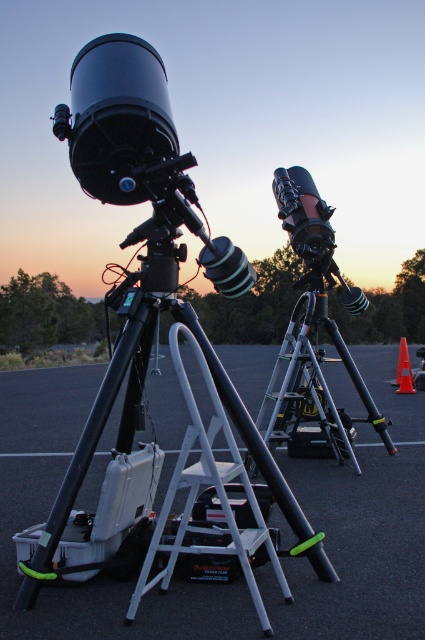
In the scene shown: You are an astronomer setting up equipment for a star observation session. You have a black plastic tripod at center. Where should you place it to align with the existing setup shown in the image?

The black plastic tripod at center should be placed at point (360, 528) as specified in the coordinates provided to align with the existing setup shown in the image.

You are an astronomer setting up equipment. You have a black plastic tripod at center and an orange plastic traffic cone at right. Which object is closer to you?

The black plastic tripod at center is closer to you because it is in front of the orange plastic traffic cone at right.

You are an astronomer setting up equipment for a star observation event. You have a black plastic tripod at center and an orange plastic traffic cone at right. You need to place a 4.5 meter long cable between them. Will the cable be long enough to connect both items without needing to extend it further?

The black plastic tripod at center is 3.95 meters away from orange plastic traffic cone at right. The 4.5 meter cable is longer than the distance between them, so it will be sufficient to connect both items without needing to extend it further.